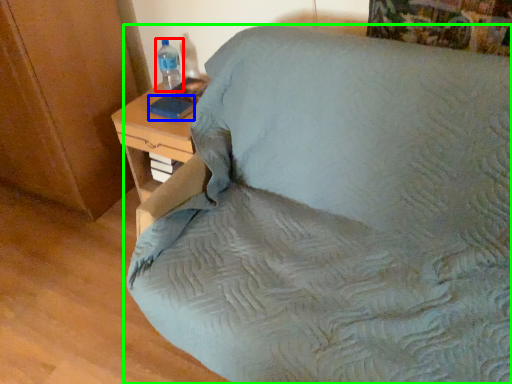
Question: Which is nearer to the bottle (highlighted by a red box)? pad (highlighted by a blue box) or furniture (highlighted by a green box).

Choices:
 (A) pad
 (B) furniture

Answer: (A)